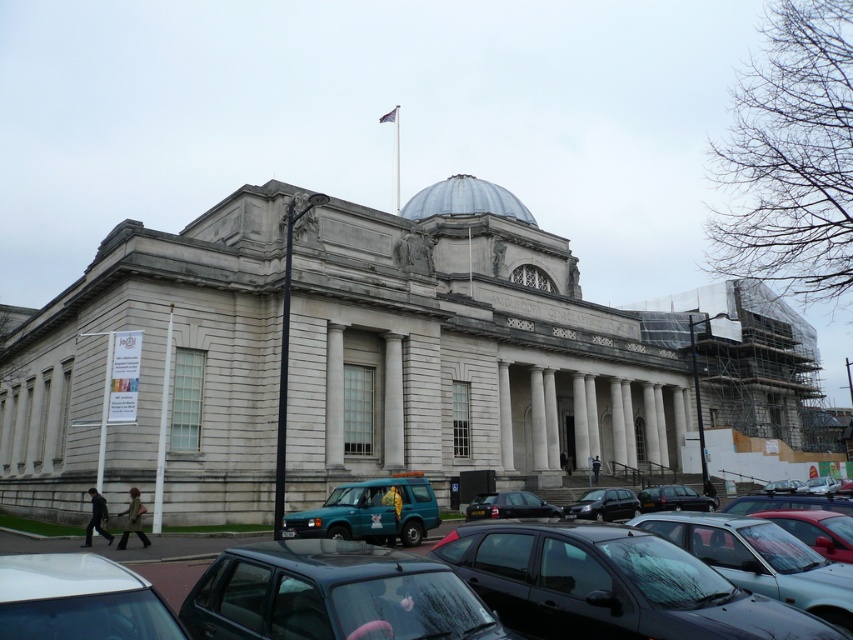
Question: Can you confirm if black glossy car at lower center is smaller than shiny black car at lower right?

Choices:
 (A) no
 (B) yes

Answer: (A)

Question: Does metallic gray cars at lower center have a greater width compared to shiny red car at lower right?

Choices:
 (A) no
 (B) yes

Answer: (B)

Question: Which object is closer to the camera taking this photo?

Choices:
 (A) metallic blue van at center
 (B) metallic silver dome at center
 (C) black glossy car at lower center

Answer: (C)

Question: Is shiny red car at lower right further to the viewer compared to black glossy car at center?

Choices:
 (A) no
 (B) yes

Answer: (A)

Question: Considering the real-world distances, which object is closest to the metallic blue van at center?

Choices:
 (A) teal matte van at lower center
 (B) black glossy car at center

Answer: (B)

Question: Based on their relative distances, which object is farther from the white matte car at lower left?

Choices:
 (A) black glossy car at lower center
 (B) matte black car at lower center
 (C) shiny red car at lower right
 (D) metallic gray cars at lower center

Answer: (C)